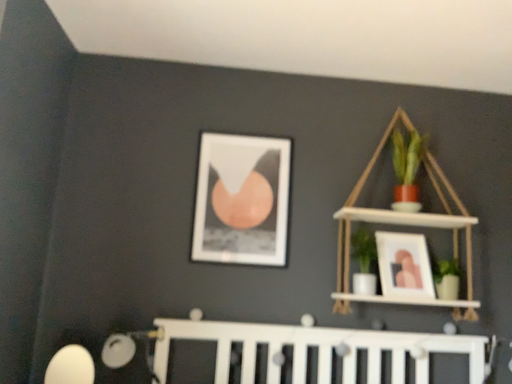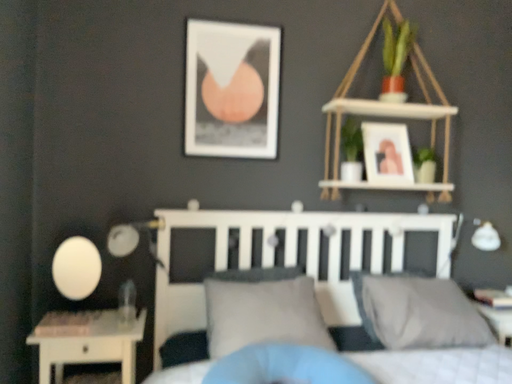
Question: Which way did the camera rotate in the video?

Choices:
 (A) rotated upward
 (B) rotated downward

Answer: (B)